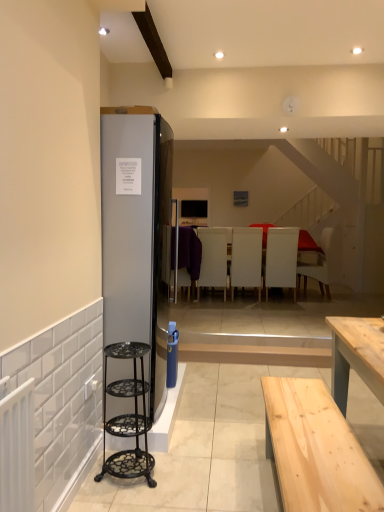
Image resolution: width=384 pixels, height=512 pixels. Identify the location of free space behind black wrought iron step stool at left. (152, 444).